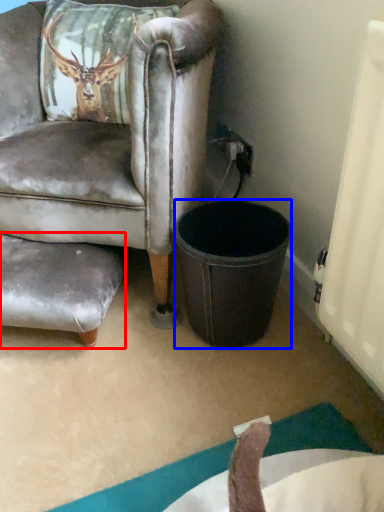
Question: Which point is closer to the camera, swivel chair (highlighted by a red box) or trash bin/can (highlighted by a blue box)?

Choices:
 (A) swivel chair
 (B) trash bin/can

Answer: (B)